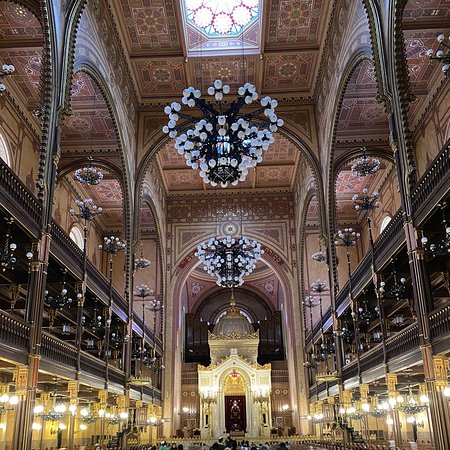
Locate an element on the screen. The image size is (450, 450). skylight is located at coordinates (223, 11).